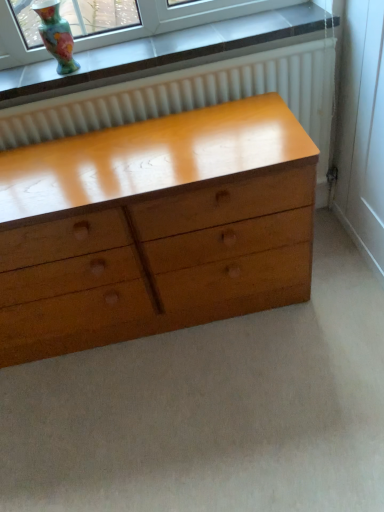
Question: In terms of width, does glossy wood chest of drawers at center look wider or thinner when compared to multicolored glass vase at upper left?

Choices:
 (A) thin
 (B) wide

Answer: (B)

Question: From the image's perspective, is glossy wood chest of drawers at center above or below multicolored glass vase at upper left?

Choices:
 (A) below
 (B) above

Answer: (A)

Question: Considering the positions of glossy wood chest of drawers at center and multicolored glass vase at upper left in the image, is glossy wood chest of drawers at center bigger or smaller than multicolored glass vase at upper left?

Choices:
 (A) small
 (B) big

Answer: (B)

Question: Looking at their shapes, would you say multicolored glass vase at upper left is wider or thinner than glossy wood chest of drawers at center?

Choices:
 (A) wide
 (B) thin

Answer: (B)

Question: In terms of height, does multicolored glass vase at upper left look taller or shorter compared to glossy wood chest of drawers at center?

Choices:
 (A) tall
 (B) short

Answer: (B)

Question: From the image's perspective, is multicolored glass vase at upper left located above or below glossy wood chest of drawers at center?

Choices:
 (A) below
 (B) above

Answer: (B)

Question: From a real-world perspective, relative to glossy wood chest of drawers at center, is multicolored glass vase at upper left vertically above or below?

Choices:
 (A) below
 (B) above

Answer: (B)